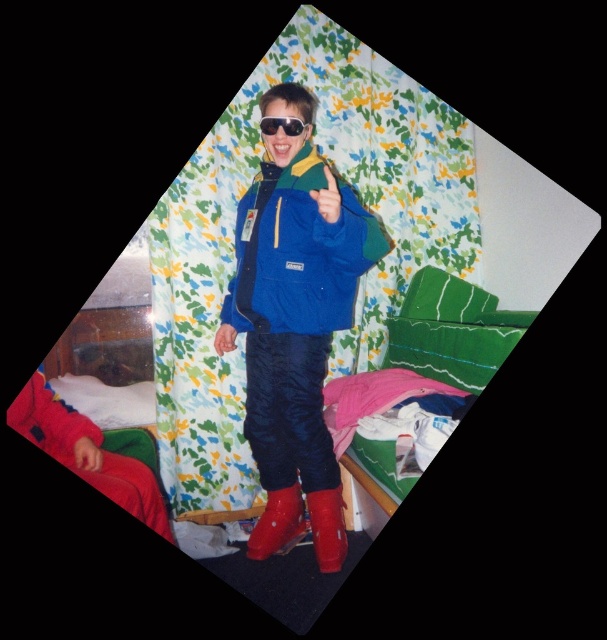
Question: Does blue matte jacket at center have a smaller size compared to rubber boots at center?

Choices:
 (A) yes
 (B) no

Answer: (B)

Question: Can you confirm if blue matte jacket at center is positioned to the right of rubber boots at center?

Choices:
 (A) yes
 (B) no

Answer: (A)

Question: Is blue matte jacket at center further to the viewer compared to black reflective sunglasses at center?

Choices:
 (A) no
 (B) yes

Answer: (A)

Question: Which object is farther from the camera taking this photo?

Choices:
 (A) blue matte jacket at center
 (B) rubber boots at center

Answer: (B)

Question: Which of these objects is positioned farthest from the rubber boots at lower center?

Choices:
 (A) matte blue jacket at center
 (B) black reflective sunglasses at center
 (C) rubber boots at center

Answer: (B)

Question: Which point is farther from the camera taking this photo?

Choices:
 (A) (253, 449)
 (B) (259, 179)

Answer: (A)